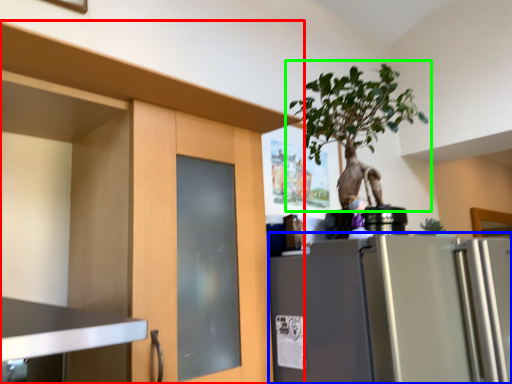
Question: Which object is the farthest from cabinetry (highlighted by a red box)? Choose among these: refrigerator (highlighted by a blue box) or houseplant (highlighted by a green box).

Choices:
 (A) refrigerator
 (B) houseplant

Answer: (B)